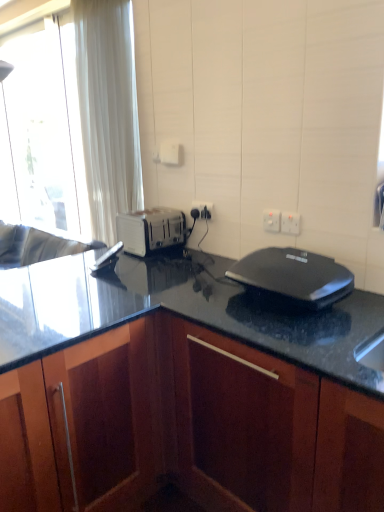
Question: From the image's perspective, is dark wood cabinet at center positioned above or below white plastic toaster at center?

Choices:
 (A) above
 (B) below

Answer: (B)

Question: Visually, is dark wood cabinet at center positioned to the left or to the right of white plastic toaster at center?

Choices:
 (A) right
 (B) left

Answer: (A)

Question: Considering the real-world distances, which object is closest to the white curtain at left?

Choices:
 (A) white plastic electric outlet at upper right, acting as the 2th electric outlet starting from the right
 (B) white plastic toaster at center
 (C) black plastic sandwich maker at center
 (D) white plastic electric outlet at upper right, arranged as the 1th electric outlet when viewed from the front
 (E) white plastic electric outlet at center, acting as the 1th electric outlet starting from the back

Answer: (B)

Question: Estimate the real-world distances between objects in this image. Which object is farther from the black plastic sandwich maker at center?

Choices:
 (A) white plastic electric outlet at upper right, marked as the 2th electric outlet in a front-to-back arrangement
 (B) white plastic electric outlet at center, the third electric outlet viewed from the right
 (C) white plastic electric outlet at upper right, acting as the third electric outlet starting from the back
 (D) dark wood cabinet at center
 (E) white plastic toaster at center

Answer: (E)